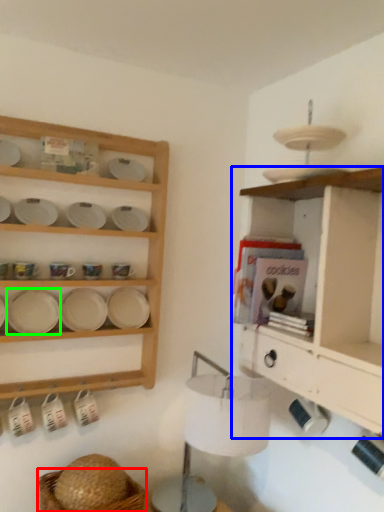
Question: Which object is the farthest from basket (highlighted by a red box)? Choose among these: shelf (highlighted by a blue box) or platter (highlighted by a green box).

Choices:
 (A) shelf
 (B) platter

Answer: (A)